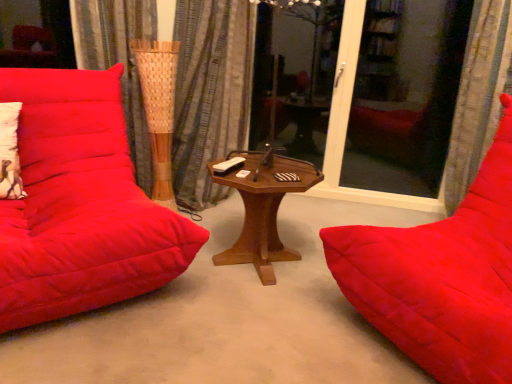
Question: Does textured fabric curtain at right, placed as the 2th curtain when sorted from left to right, have a larger size compared to transparent glass screen door at right?

Choices:
 (A) yes
 (B) no

Answer: (A)

Question: Is textured fabric curtain at right, the 1th curtain in the right-to-left sequence, positioned far away from transparent glass screen door at right?

Choices:
 (A) no
 (B) yes

Answer: (A)

Question: Would you say textured fabric curtain at right, placed as the 2th curtain when sorted from left to right, contains transparent glass screen door at right?

Choices:
 (A) no
 (B) yes

Answer: (A)

Question: Is textured fabric curtain at right, placed as the 2th curtain when sorted from left to right, at the left side of transparent glass screen door at right?

Choices:
 (A) no
 (B) yes

Answer: (A)

Question: From a real-world perspective, is textured fabric curtain at right, the 1th curtain in the right-to-left sequence, located beneath transparent glass screen door at right?

Choices:
 (A) yes
 (B) no

Answer: (B)

Question: Is point (501, 218) positioned closer to the camera than point (178, 67)?

Choices:
 (A) closer
 (B) farther

Answer: (A)

Question: In terms of height, does velvet red studio couch at right, which ranks as the first studio couch in right-to-left order, look taller or shorter compared to blue striped curtain at center, which ranks as the first curtain in left-to-right order?

Choices:
 (A) short
 (B) tall

Answer: (A)

Question: From the image's perspective, relative to blue striped curtain at center, which ranks as the first curtain in left-to-right order, is velvet red studio couch at right, the second studio couch positioned from the left, above or below?

Choices:
 (A) above
 (B) below

Answer: (B)

Question: In the image, is velvet red studio couch at right, which ranks as the first studio couch in right-to-left order, on the left side or the right side of blue striped curtain at center, which is the second curtain in right-to-left order?

Choices:
 (A) right
 (B) left

Answer: (A)

Question: Is wooden hexagonal table at center situated inside transparent glass screen door at right or outside?

Choices:
 (A) outside
 (B) inside

Answer: (A)

Question: Considering the positions of point (293, 158) and point (438, 9), is point (293, 158) closer or farther from the camera than point (438, 9)?

Choices:
 (A) farther
 (B) closer

Answer: (B)

Question: From the image's perspective, is wooden hexagonal table at center above or below transparent glass screen door at right?

Choices:
 (A) above
 (B) below

Answer: (B)

Question: Considering the relative positions of wooden hexagonal table at center and transparent glass screen door at right in the image provided, is wooden hexagonal table at center to the left or to the right of transparent glass screen door at right?

Choices:
 (A) left
 (B) right

Answer: (A)

Question: Is velvet red studio couch at left, the first studio couch in the left-to-right sequence, wider or thinner than textured fabric curtain at right, placed as the 2th curtain when sorted from left to right?

Choices:
 (A) wide
 (B) thin

Answer: (A)

Question: Is velvet red studio couch at left, which is counted as the second studio couch, starting from the right, inside or outside of textured fabric curtain at right, the 1th curtain in the right-to-left sequence?

Choices:
 (A) outside
 (B) inside

Answer: (A)